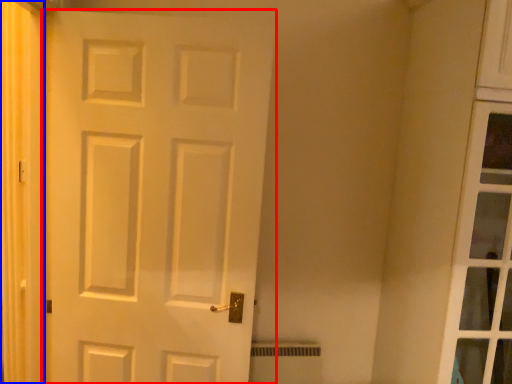
Question: Which of the following is the farthest to the observer, door (highlighted by a red box) or curtain (highlighted by a blue box)?

Choices:
 (A) door
 (B) curtain

Answer: (A)